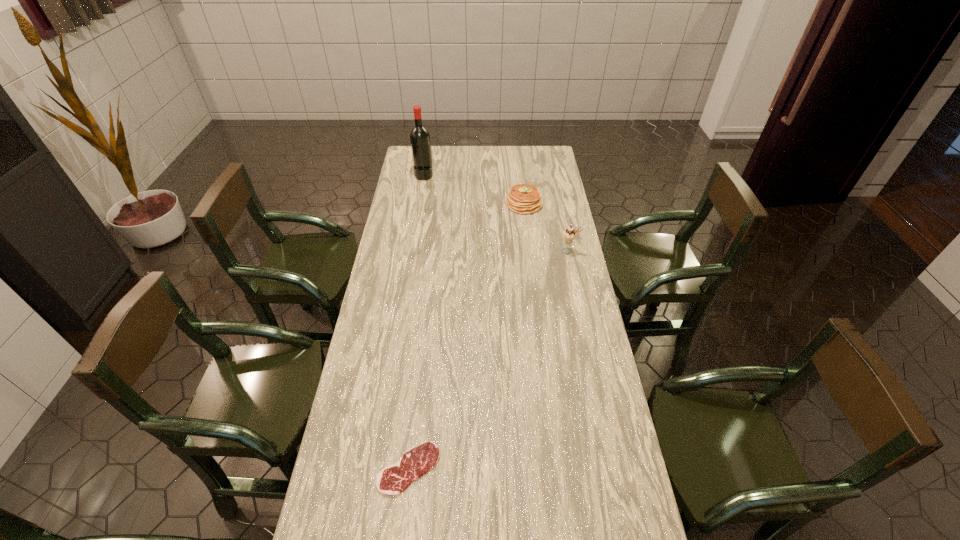
At what (x,y) coordinates should I click in order to perform the action: click on blank space at the right edge of the desktop. Please return your answer as a coordinate pair (x, y). Looking at the image, I should click on (576, 481).

The height and width of the screenshot is (540, 960). In the image, there is a desktop. What are the coordinates of `free space at the far right corner` in the screenshot? It's located at 535,157.

The height and width of the screenshot is (540, 960). I want to click on free area in between the third farthest object and the tallest object, so click(x=496, y=213).

Locate an element on the screen. free space between the nearest object and the icecream is located at coordinates 489,360.

Identify the location of vacant point located between the nearest object and the icecream. (489, 360).

This screenshot has height=540, width=960. What are the coordinates of `free space between the nearest object and the third nearest object` in the screenshot? It's located at (467, 336).

The image size is (960, 540). Identify the location of free area in between the shortest object and the rightmost object. (489, 360).

Identify the location of free space between the second tallest object and the nearest object. The image size is (960, 540). (489, 360).

You are a GUI agent. You are given a task and a screenshot of the screen. Output one action in this format:
    pyautogui.click(x=<x>, y=<y>)
    Task: Click on the vacant area that lies between the wine bottle and the pancake
    Image resolution: width=960 pixels, height=540 pixels.
    Given the screenshot: What is the action you would take?
    pyautogui.click(x=474, y=190)

Image resolution: width=960 pixels, height=540 pixels. In order to click on free spot between the shortest object and the farthest object in this screenshot , I will do `click(417, 322)`.